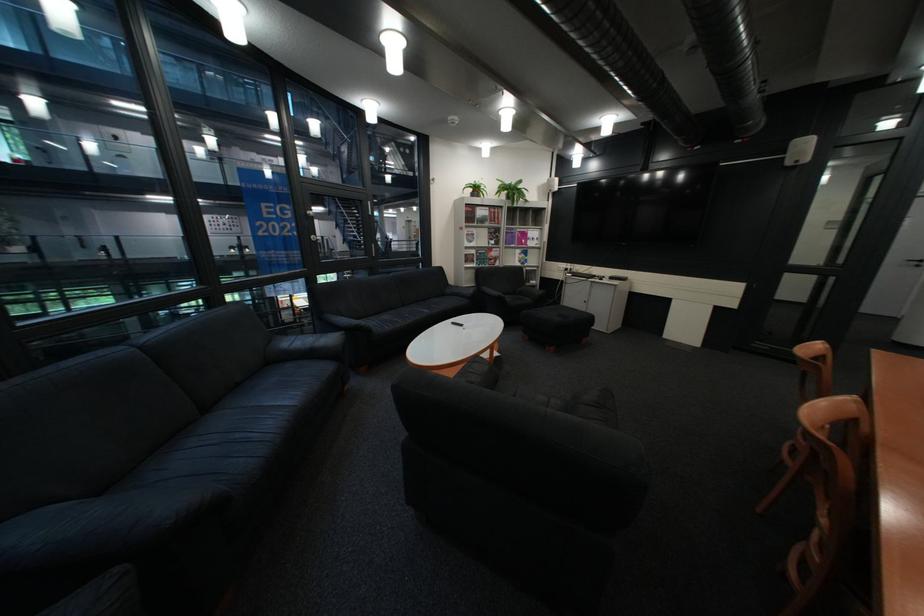
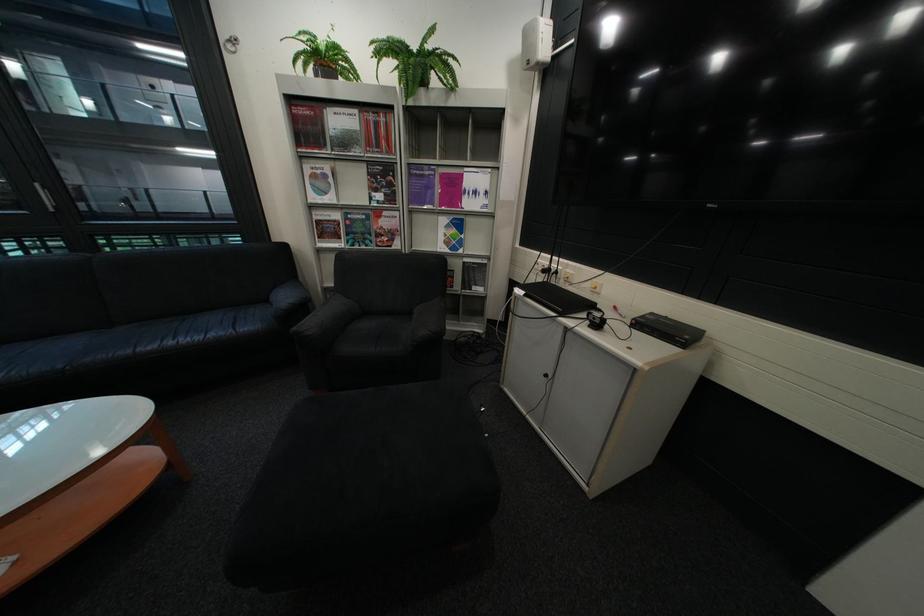
The point at (545, 244) is marked in the first image. Where is the corresponding point in the second image?

(484, 204)